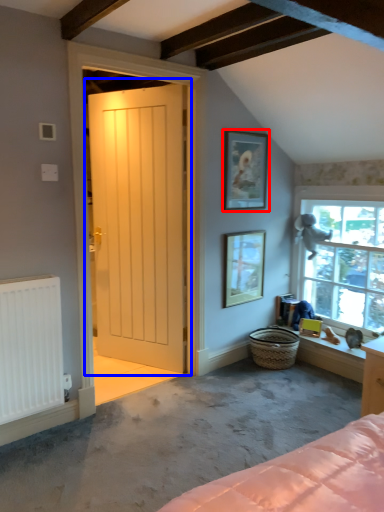
Question: Which point is closer to the camera, picture frame (highlighted by a red box) or door (highlighted by a blue box)?

Choices:
 (A) picture frame
 (B) door

Answer: (B)